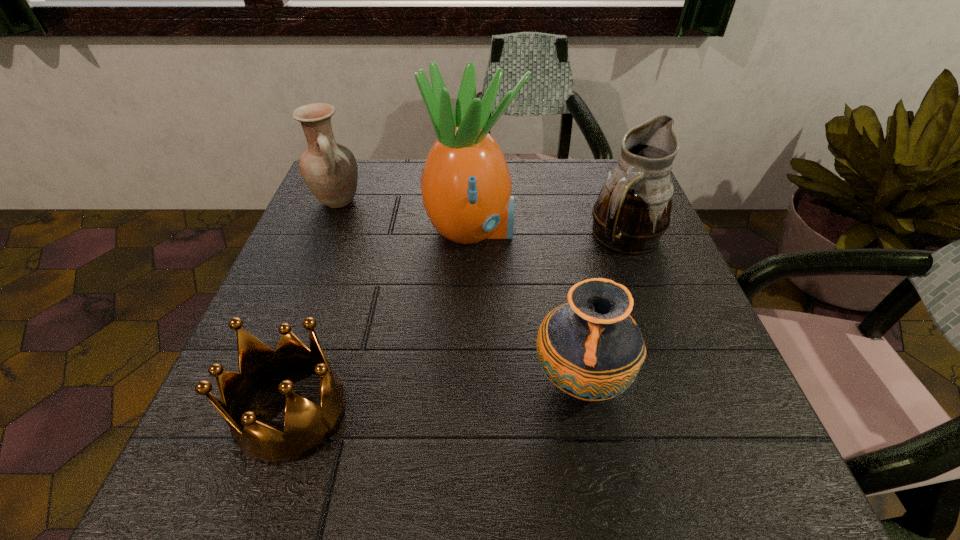
You are a GUI agent. You are given a task and a screenshot of the screen. Output one action in this format:
    pyautogui.click(x=<x>, y=<y>)
    Task: Click on the pineapple
    
    Given the screenshot: What is the action you would take?
    pyautogui.click(x=466, y=186)

Find the location of a particular element. This screenshot has width=960, height=540. pitcher is located at coordinates (632, 212).

Locate an element on the screen. the farther pottery is located at coordinates (329, 169).

Locate an element on the screen. the shorter pottery is located at coordinates (590, 348).

You are a GUI agent. You are given a task and a screenshot of the screen. Output one action in this format:
    pyautogui.click(x=<x>, y=<y>)
    Task: Click on the nearer pottery
    Image resolution: width=960 pixels, height=540 pixels.
    Given the screenshot: What is the action you would take?
    pyautogui.click(x=590, y=348)

This screenshot has height=540, width=960. Identify the location of the shortest object. (307, 426).

Image resolution: width=960 pixels, height=540 pixels. In order to click on vacant space located 0.090m at the entrance of the pineapple in this screenshot , I will do `click(560, 231)`.

At what (x,y) coordinates should I click in order to perform the action: click on free space located 0.400m from the spout of the pitcher. Please return your answer as a coordinate pair (x, y). Looking at the image, I should click on [708, 456].

Identify the location of free space located 0.330m on the right of the left pottery. This screenshot has width=960, height=540. (497, 201).

I want to click on free space located 0.350m on the back of the shorter pottery, so [x=550, y=222].